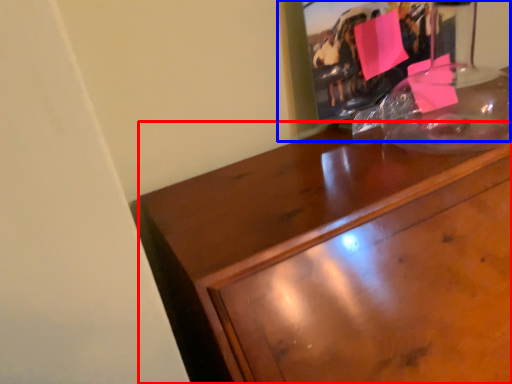
Question: Which of the following is the farthest to the observer, desk (highlighted by a red box) or picture frame (highlighted by a blue box)?

Choices:
 (A) desk
 (B) picture frame

Answer: (B)